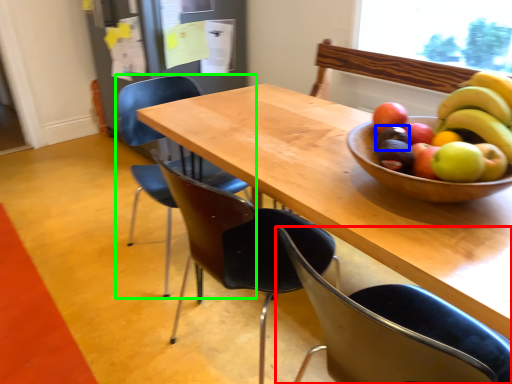
Question: Which object is positioned farthest from chair (highlighted by a red box)? Select from avocado (highlighted by a blue box) and chair (highlighted by a green box).

Choices:
 (A) avocado
 (B) chair

Answer: (B)